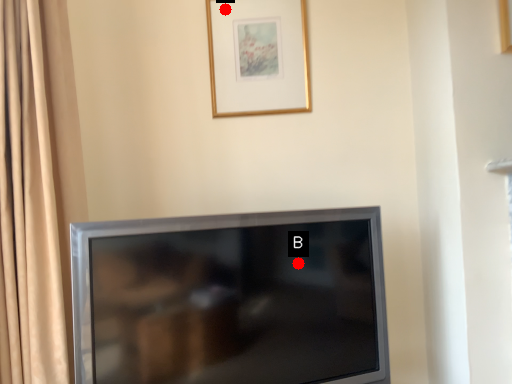
Question: Two points are circled on the image, labeled by A and B beside each circle. Which point is further to the camera?

Choices:
 (A) A is further
 (B) B is further

Answer: (A)